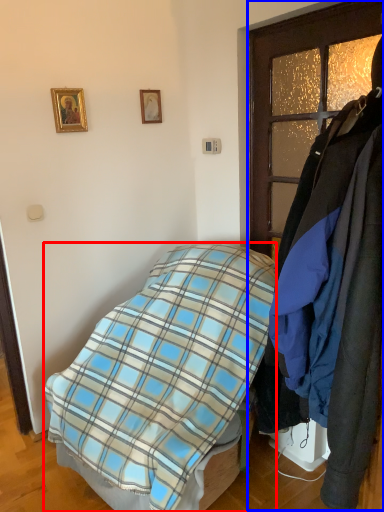
Question: Which of the following is the closest to the observer, bed (highlighted by a red box) or closet (highlighted by a blue box)?

Choices:
 (A) bed
 (B) closet

Answer: (B)